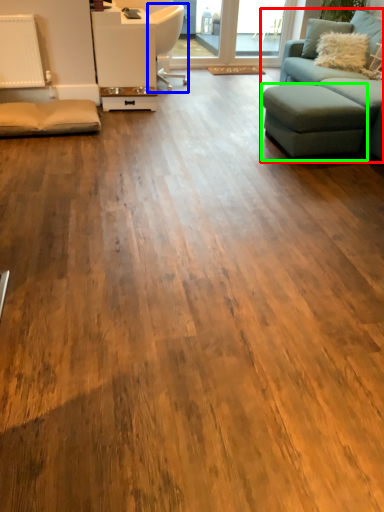
Question: Which is farther away from studio couch (highlighted by a red box)? chair (highlighted by a blue box) or footrest (highlighted by a green box)?

Choices:
 (A) chair
 (B) footrest

Answer: (A)